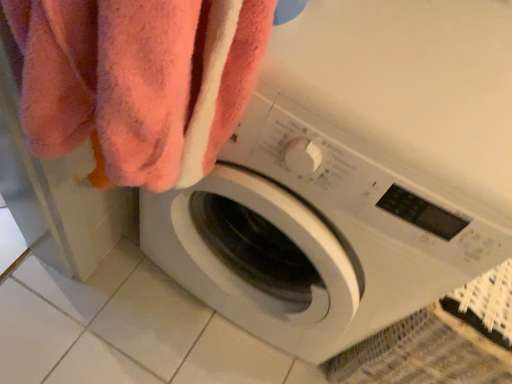
Question: Should I look upward or downward to see soft pink towel at upper left?

Choices:
 (A) down
 (B) up

Answer: (B)

Question: From the image's perspective, is white plastic washing machine at center located beneath soft pink towel at upper left?

Choices:
 (A) yes
 (B) no

Answer: (B)

Question: Is the position of white plastic washing machine at center less distant than that of soft pink towel at upper left?

Choices:
 (A) yes
 (B) no

Answer: (A)

Question: Is white plastic washing machine at center outside of soft pink towel at upper left?

Choices:
 (A) yes
 (B) no

Answer: (A)

Question: Can you confirm if white plastic washing machine at center is shorter than soft pink towel at upper left?

Choices:
 (A) yes
 (B) no

Answer: (B)

Question: Does white plastic washing machine at center lie behind soft pink towel at upper left?

Choices:
 (A) yes
 (B) no

Answer: (B)

Question: Is white plastic washing machine at center far from soft pink towel at upper left?

Choices:
 (A) yes
 (B) no

Answer: (B)

Question: Is soft pink towel at upper left to the left of white plastic washing machine at center from the viewer's perspective?

Choices:
 (A) yes
 (B) no

Answer: (A)

Question: From the image's perspective, is soft pink towel at upper left over white plastic washing machine at center?

Choices:
 (A) no
 (B) yes

Answer: (A)

Question: Is soft pink towel at upper left positioned with its back to white plastic washing machine at center?

Choices:
 (A) yes
 (B) no

Answer: (A)

Question: Is soft pink towel at upper left in front of white plastic washing machine at center?

Choices:
 (A) yes
 (B) no

Answer: (B)

Question: Does soft pink towel at upper left have a lesser height compared to white plastic washing machine at center?

Choices:
 (A) no
 (B) yes

Answer: (B)

Question: From a real-world perspective, is soft pink towel at upper left physically above white plastic washing machine at center?

Choices:
 (A) no
 (B) yes

Answer: (B)

Question: Looking at the image, does soft pink towel at upper left seem bigger or smaller compared to white plastic washing machine at center?

Choices:
 (A) big
 (B) small

Answer: (B)